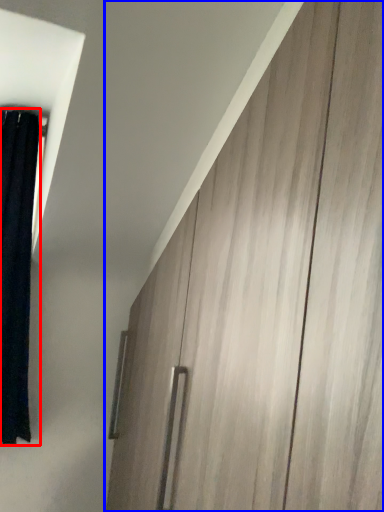
Question: Which object appears farthest to the camera in this image, curtain (highlighted by a red box) or barn door (highlighted by a blue box)?

Choices:
 (A) curtain
 (B) barn door

Answer: (A)